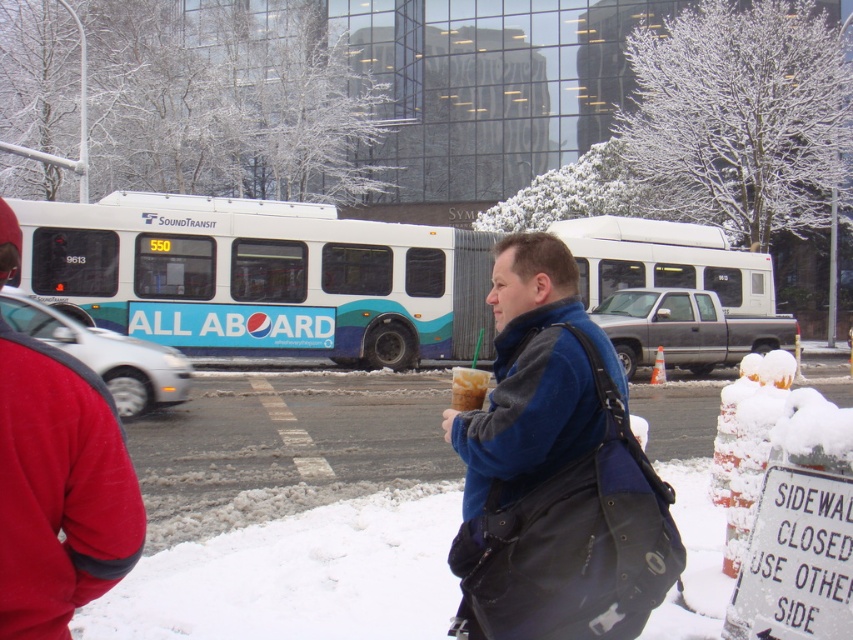
Who is more forward, (544, 241) or (469, 406)?

Positioned in front is point (544, 241).

Between point (503, 349) and point (466, 406), which one is positioned in front?

Point (503, 349) is in front.

You are a GUI agent. You are given a task and a screenshot of the screen. Output one action in this format:
    pyautogui.click(x=<x>, y=<y>)
    Task: Click on the blue fleece jacket at center
    
    Given the screenshot: What is the action you would take?
    pyautogui.click(x=555, y=472)

Is point (178, 326) behind point (596, 428)?

That is True.

Is the position of white glossy bus at upper center more distant than that of blue fleece jacket at center?

Yes, it is.

At what (x,y) coordinates should I click in order to perform the action: click on white glossy bus at upper center. Please return your answer as a coordinate pair (x, y). Image resolution: width=853 pixels, height=640 pixels. Looking at the image, I should click on (262, 276).

Find the location of `white glossy bus at upper center`. white glossy bus at upper center is located at coordinates (262, 276).

Is point (222, 342) less distant than point (85, 394)?

No, (222, 342) is behind (85, 394).

Where is `white glossy bus at upper center`? The width and height of the screenshot is (853, 640). white glossy bus at upper center is located at coordinates (262, 276).